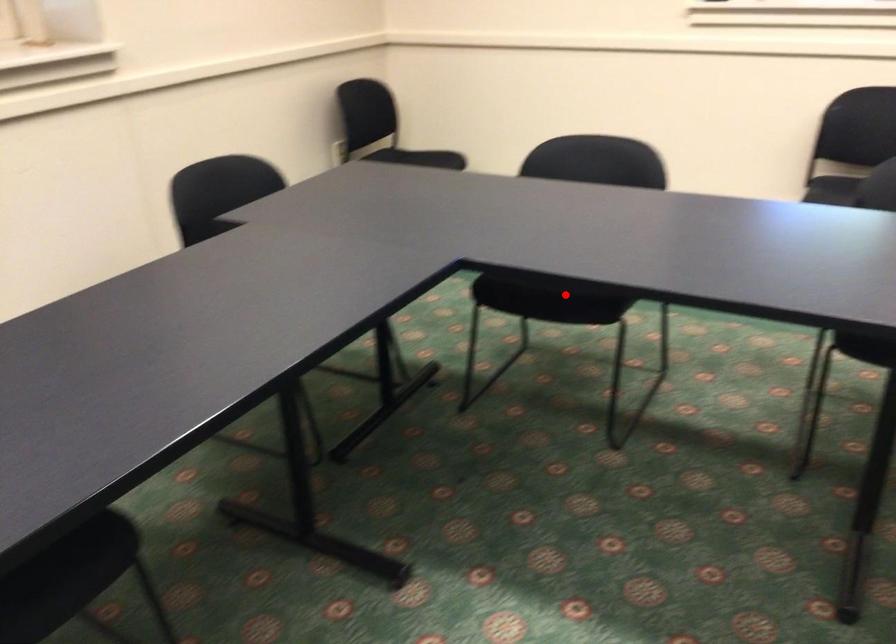
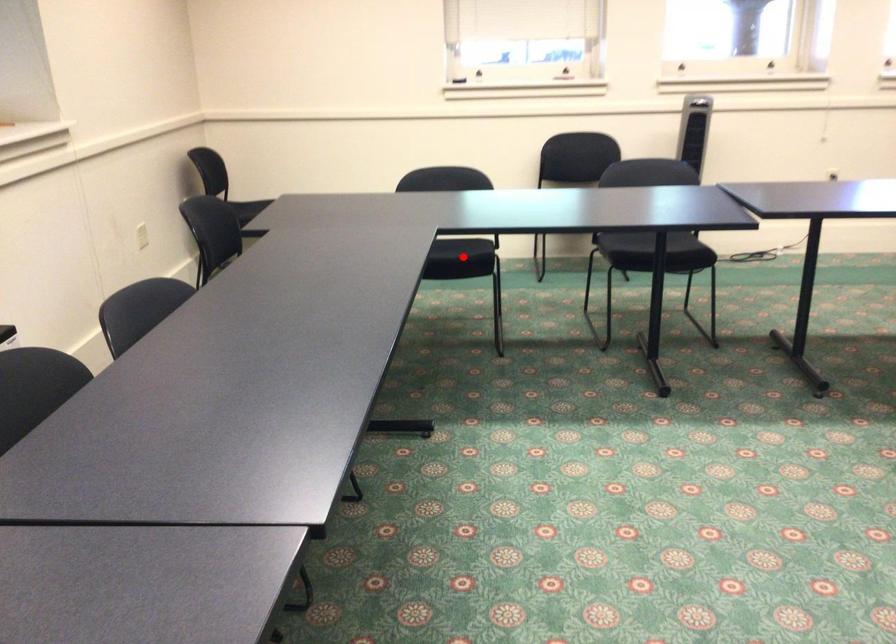
I am providing you with two images of the same scene from different viewpoints. A red point is marked on the first image and another point is marked on the second image. Does the point marked in image1 correspond to the same location as the one in image2?

Yes